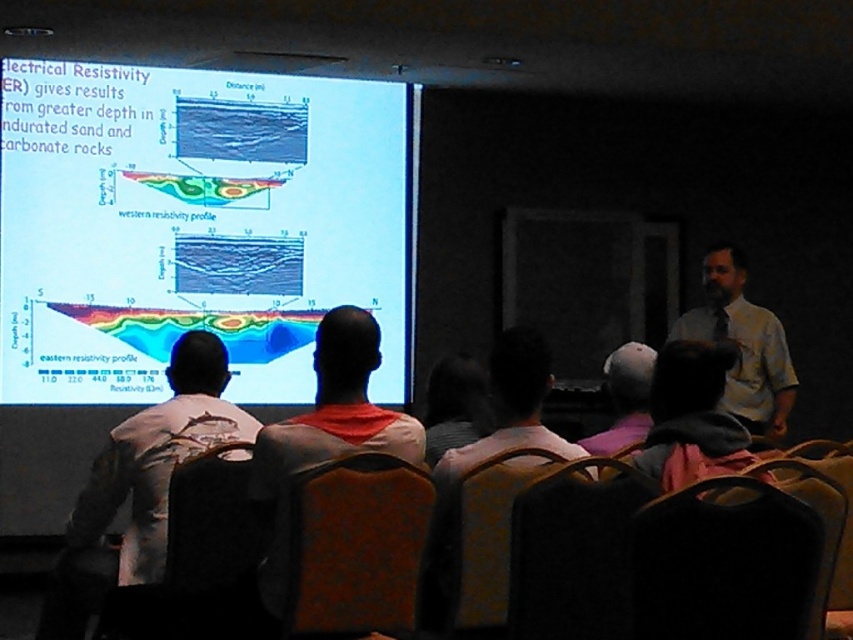
You are sitting in the velvet brown chair at lower left and want to look at the orange fabric shirt at center. Which direction should you turn your head?

Since the velvet brown chair at lower left is positioned under the orange fabric shirt at center, you should look upward to see the orange fabric shirt at center.